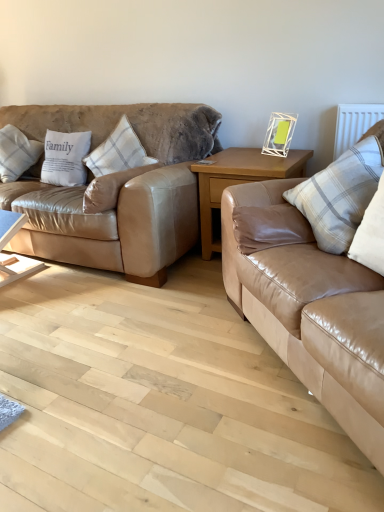
Question: Does white cotton pillow at left, acting as the 2th pillow starting from the left, come in front of white plaid pillow at left, which is counted as the third pillow, starting from the right?

Choices:
 (A) no
 (B) yes

Answer: (A)

Question: Considering the relative sizes of white cotton pillow at left, arranged as the 4th pillow when viewed from the right, and white plaid pillow at left, which is counted as the third pillow, starting from the right, in the image provided, is white cotton pillow at left, arranged as the 4th pillow when viewed from the right, smaller than white plaid pillow at left, which is counted as the third pillow, starting from the right,?

Choices:
 (A) yes
 (B) no

Answer: (A)

Question: Is there a large distance between white cotton pillow at left, arranged as the 4th pillow when viewed from the right, and white plaid pillow at left, the 3th pillow viewed from the left?

Choices:
 (A) yes
 (B) no

Answer: (B)

Question: Can you confirm if white cotton pillow at left, arranged as the 4th pillow when viewed from the right, is bigger than white plaid pillow at left, the 3th pillow viewed from the left?

Choices:
 (A) yes
 (B) no

Answer: (B)

Question: From a real-world perspective, is white cotton pillow at left, arranged as the 4th pillow when viewed from the right, located beneath white plaid pillow at left, which is counted as the third pillow, starting from the right?

Choices:
 (A) yes
 (B) no

Answer: (A)

Question: Is the position of white cotton pillow at left, arranged as the 4th pillow when viewed from the right, more distant than that of white plaid pillow at left, the 3th pillow viewed from the left?

Choices:
 (A) yes
 (B) no

Answer: (A)

Question: Can you confirm if white cotton pillow at left, arranged as the 4th pillow when viewed from the right, is positioned to the right of white plaid pillow at left, placed as the first pillow when sorted from left to right?

Choices:
 (A) no
 (B) yes

Answer: (B)

Question: Could you tell me if white cotton pillow at left, arranged as the 4th pillow when viewed from the right, is turned towards white plaid pillow at left, positioned as the 5th pillow in right-to-left order?

Choices:
 (A) no
 (B) yes

Answer: (A)

Question: From the image's perspective, is white cotton pillow at left, acting as the 2th pillow starting from the left, located above white plaid pillow at left, positioned as the 5th pillow in right-to-left order?

Choices:
 (A) no
 (B) yes

Answer: (A)

Question: Does white cotton pillow at left, acting as the 2th pillow starting from the left, have a lesser height compared to white plaid pillow at left, positioned as the 5th pillow in right-to-left order?

Choices:
 (A) no
 (B) yes

Answer: (B)

Question: Is white cotton pillow at left, acting as the 2th pillow starting from the left, looking in the opposite direction of white plaid pillow at left, positioned as the 5th pillow in right-to-left order?

Choices:
 (A) no
 (B) yes

Answer: (A)

Question: Would you consider white cotton pillow at left, arranged as the 4th pillow when viewed from the right, to be distant from white plaid pillow at left, positioned as the 5th pillow in right-to-left order?

Choices:
 (A) no
 (B) yes

Answer: (A)

Question: Is tan leather couch at right, marked as the 2th studio couch in a left-to-right arrangement, bigger than white plaid pillow at left, the 3th pillow viewed from the left?

Choices:
 (A) no
 (B) yes

Answer: (B)